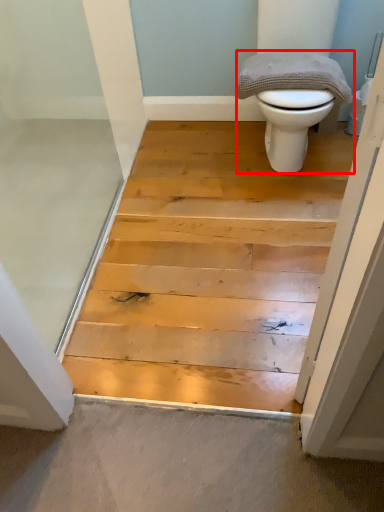
Question: From the image's perspective, where is toilet (annotated by the red box) located relative to material?

Choices:
 (A) above
 (B) below

Answer: (A)